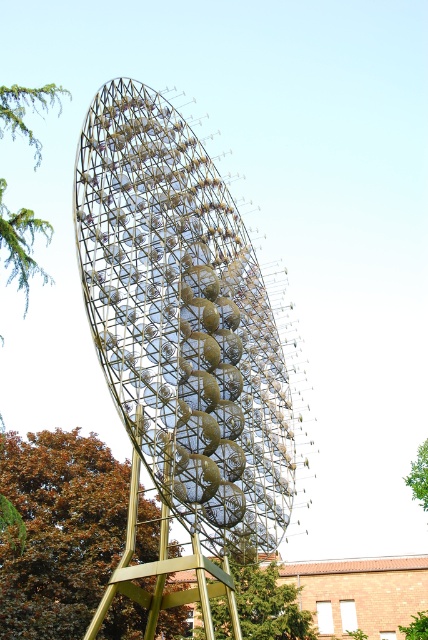
You are standing in front of the metal sculpture and notice two green leafy trees in the scene. Which tree, the green leafy tree at lower left or the green leafy tree at lower center, is positioned higher up from the ground?

The green leafy tree at lower left is positioned higher up from the ground than the green leafy tree at lower center.

You are a landscape architect designing a garden around the spiral sculpture. You need to ensure that the green leafy tree at lower left and the green leafy tree at lower center do not block the view of the sculpture. Which tree requires more careful pruning to maintain visibility?

The green leafy tree at lower left might require more careful pruning since it might be wider than the green leafy tree at lower center, potentially obstructing the view more.

You are an architect planning to install a new sculpture in a park. The sculpture you want to install is 23 meters tall. You need to ensure that the sculpture will not block the view of the green leafy tree at upper left from the metallic structure at center. Based on the information provided, will the new sculpture block the view?

The metallic structure at center is 23.29 meters away from the green leafy tree at upper left. Since the new sculpture is 23 meters tall, it would be shorter than the distance between them. Therefore, the sculpture will not block the view of the green leafy tree at upper left from the metallic structure at center.